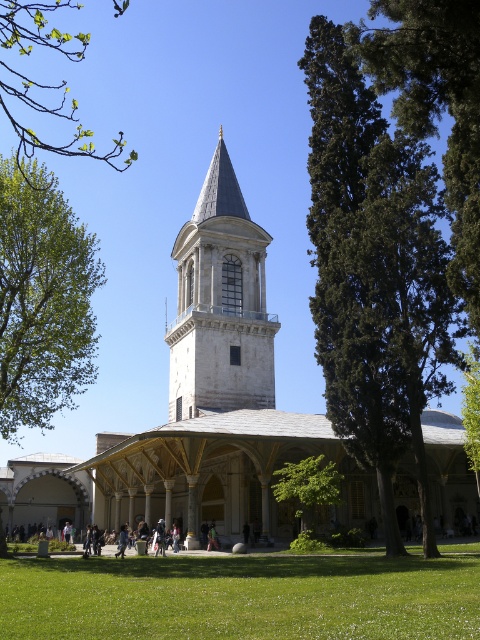
You are standing in front of the historical building and see both the green leafy tree at left and the green leafy branch at upper left. Which one is more to the left?

The green leafy tree at left is more to the left side of the green leafy branch at upper left.

You are standing in front of the historical building and want to take a photo that includes both the green leafy tree at left and the green leafy branch at upper left. Considering their distances from you, will they both appear in the same frame?

The green leafy tree at left is 18.77 meters away from the green leafy branch at upper left. Since they are at different distances, but both within a reasonable range, they should both appear in the same frame as long as your camera has a wide enough angle or you position yourself appropriately.

You are standing in front of the historical Ottoman building and want to take a photo that includes both the green leafy tree at left and the minaret. Based on their positions, where should you position yourself to ensure both are in the frame?

Since the green leafy tree at left is located at point (43, 298), you should position yourself in a spot that allows the camera to capture both the tree at that coordinate and the minaret, which is on the right side of the building. This likely means standing near the center front of the building to include both elements in the frame.